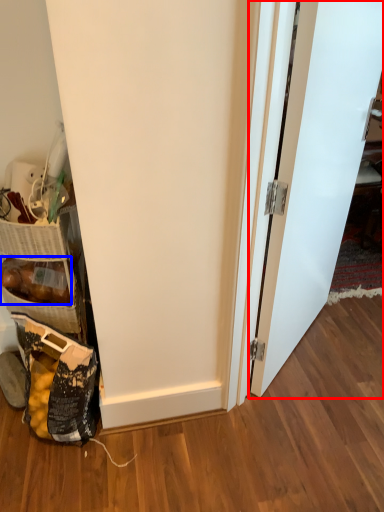
Question: Which point is further to the camera, door (highlighted by a red box) or stuff (highlighted by a blue box)?

Choices:
 (A) door
 (B) stuff

Answer: (B)